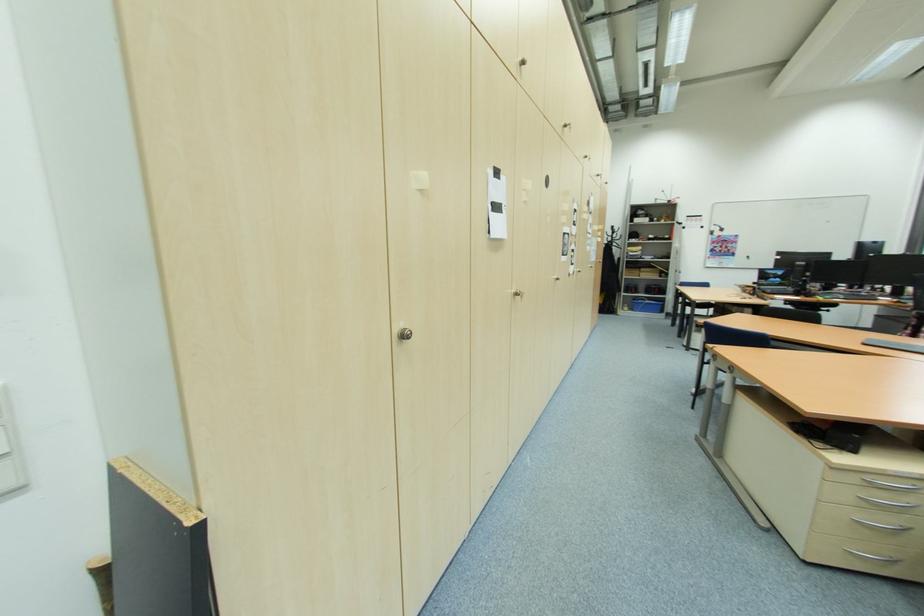
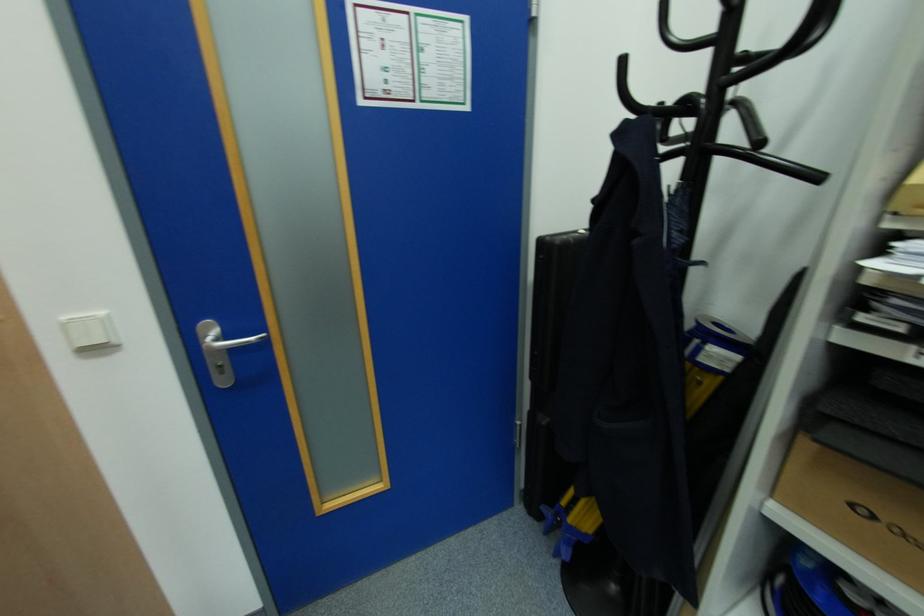
Find the pixel in the second image that matches (616,238) in the first image.

(726, 61)